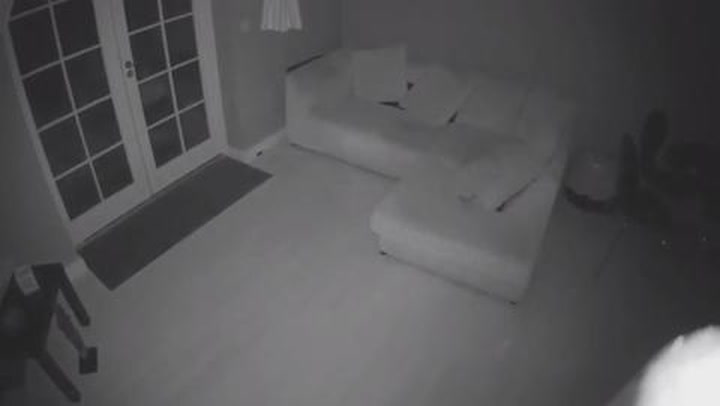
Where is `floor`? The height and width of the screenshot is (406, 720). floor is located at coordinates (346, 331).